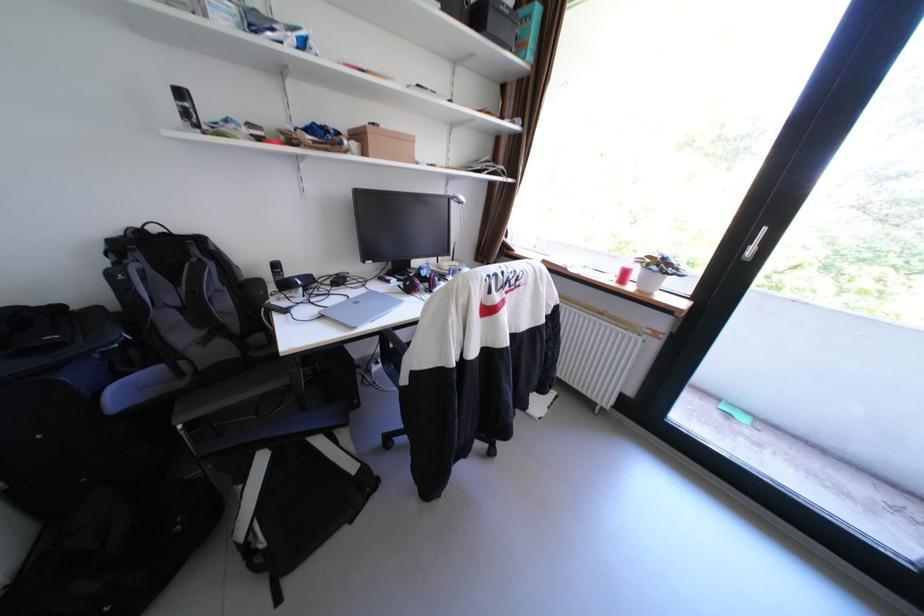
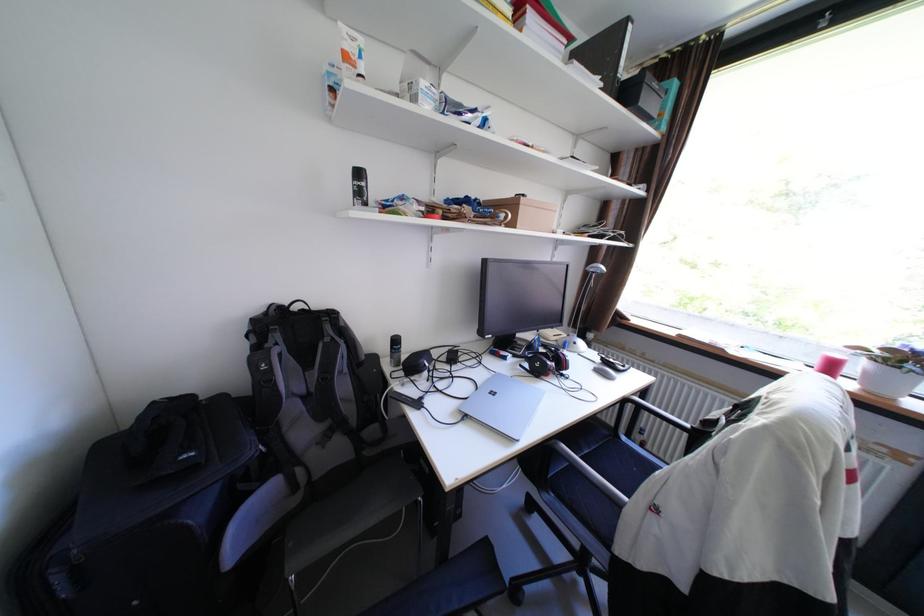
Question: What movement of the cameraman would produce the second image?

Choices:
 (A) Left
 (B) Right
 (C) Forward
 (D) Backward

Answer: (A)